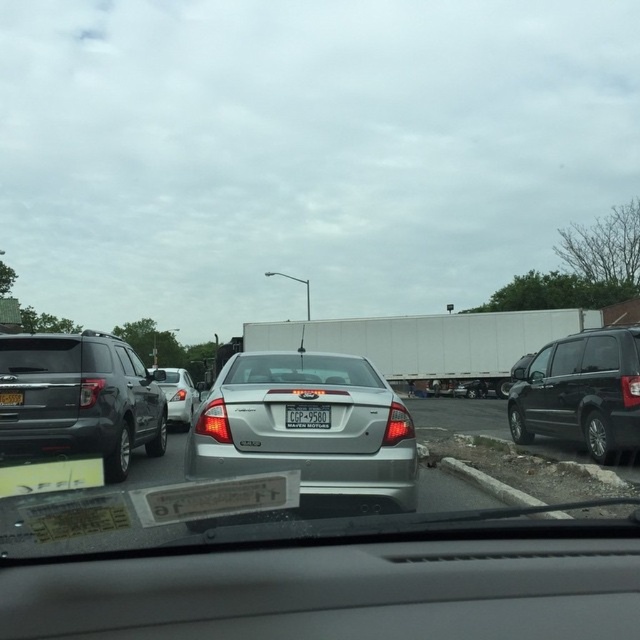
Question: Is satin silver sedan at center bigger than white plastic license plate at center?

Choices:
 (A) yes
 (B) no

Answer: (A)

Question: Which object is positioned farthest from the white matte trailer truck at center?

Choices:
 (A) clear glass windshield at center
 (B) satin silver sedan at center
 (C) silver metallic sedan at center

Answer: (B)

Question: Is matte gray suv at left below silver metallic sedan at center?

Choices:
 (A) yes
 (B) no

Answer: (B)

Question: Is the position of matte gray suv at left less distant than that of silver metallic sedan at center?

Choices:
 (A) yes
 (B) no

Answer: (A)

Question: Among these points, which one is nearest to the camera?

Choices:
 (A) (582, 412)
 (B) (355, 358)
 (C) (51, 358)
 (D) (560, 310)

Answer: (B)

Question: Which of the following is the farthest from the observer?

Choices:
 (A) (x=81, y=413)
 (B) (x=596, y=401)
 (C) (x=296, y=412)
 (D) (x=22, y=397)

Answer: (B)